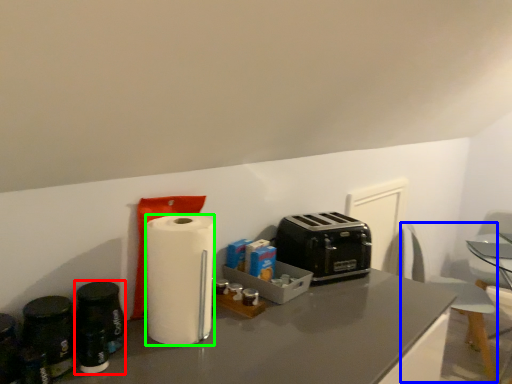
Question: Which is farther away from appliance (highlighted by a red box)? swivel chair (highlighted by a blue box) or paper towel (highlighted by a green box)?

Choices:
 (A) swivel chair
 (B) paper towel

Answer: (A)